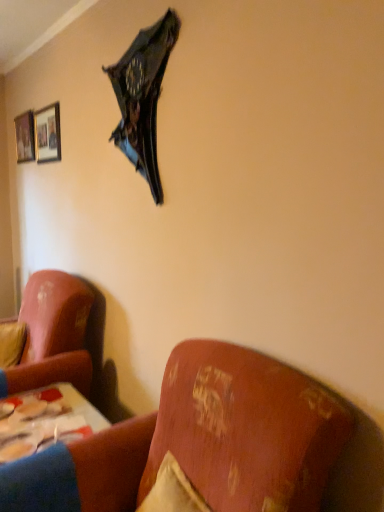
What is the approximate width of wooden table at lower left?

16.93 inches.

What do you see at coordinates (25, 137) in the screenshot? I see `wooden framed picture at upper left, the second picture frame when ordered from right to left` at bounding box center [25, 137].

What is the approximate width of wooden framed picture at upper left, the second picture frame when ordered from right to left?

wooden framed picture at upper left, the second picture frame when ordered from right to left, is 1.41 inches in width.

This screenshot has height=512, width=384. What do you see at coordinates (200, 441) in the screenshot?
I see `velvet-like pink couch at lower left` at bounding box center [200, 441].

This screenshot has height=512, width=384. What do you see at coordinates (48, 134) in the screenshot? I see `matte black picture frame at upper left, which is the 1th picture frame from front to back` at bounding box center [48, 134].

What is the approximate width of velvet yellow pillow at left?

velvet yellow pillow at left is 23.47 centimeters in width.

Identify the location of wooden table at lower left. This screenshot has width=384, height=512. (45, 420).

Measure the distance from wooden framed picture at upper left, arranged as the 1th picture frame when viewed from the back, to velvet-like pink couch at lower left.

wooden framed picture at upper left, arranged as the 1th picture frame when viewed from the back, is 2.48 meters from velvet-like pink couch at lower left.

You are a GUI agent. You are given a task and a screenshot of the screen. Output one action in this format:
    pyautogui.click(x=<x>, y=<y>)
    Task: Click on the 2nd picture frame behind the velvet-like pink couch at lower left
    Image resolution: width=384 pixels, height=512 pixels.
    Given the screenshot: What is the action you would take?
    pyautogui.click(x=25, y=137)

Can you confirm if wooden framed picture at upper left, arranged as the 1th picture frame when viewed from the back, is positioned to the left of velvet-like pink couch at lower left?

Yes.

Does wooden framed picture at upper left, marked as the 2th picture frame in a front-to-back arrangement, have a lesser width compared to velvet-like pink couch at lower left?

Correct, the width of wooden framed picture at upper left, marked as the 2th picture frame in a front-to-back arrangement, is less than that of velvet-like pink couch at lower left.

Would you say wooden table at lower left is inside or outside wooden framed picture at upper left, arranged as the 1th picture frame when viewed from the back?

wooden table at lower left is not enclosed by wooden framed picture at upper left, arranged as the 1th picture frame when viewed from the back.

Can you confirm if wooden table at lower left is positioned to the left of wooden framed picture at upper left, the second picture frame when ordered from right to left?

No.

Can you confirm if wooden table at lower left is bigger than wooden framed picture at upper left, arranged as the 1th picture frame when viewed from the back?

Yes.

Looking at this image, from a real-world perspective, is wooden table at lower left positioned under wooden framed picture at upper left, arranged as the 1th picture frame when viewed from the back, based on gravity?

Yes, from a real-world perspective, wooden table at lower left is under wooden framed picture at upper left, arranged as the 1th picture frame when viewed from the back.

Is wooden table at lower left far from velvet yellow pillow at left?

Actually, wooden table at lower left and velvet yellow pillow at left are a little close together.

Which object is wider, wooden table at lower left or velvet yellow pillow at left?

Wider between the two is wooden table at lower left.

Looking at this image, how far apart are wooden table at lower left and velvet yellow pillow at left?

wooden table at lower left and velvet yellow pillow at left are 17.99 inches apart from each other.

Which object is further away from the camera, wooden table at lower left or velvet yellow pillow at left?

velvet yellow pillow at left is more distant.

Could you tell me if shiny metallic umbrella at upper center is turned towards matte black picture frame at upper left, the second picture frame from the left?

No, shiny metallic umbrella at upper center is not turned towards matte black picture frame at upper left, the second picture frame from the left.

From a real-world perspective, is shiny metallic umbrella at upper center on matte black picture frame at upper left, which is the 1th picture frame from front to back?

No, from a real-world perspective, shiny metallic umbrella at upper center is not on top of matte black picture frame at upper left, which is the 1th picture frame from front to back.

From the image's perspective, which object appears higher, shiny metallic umbrella at upper center or matte black picture frame at upper left, the second picture frame from the left?

matte black picture frame at upper left, the second picture frame from the left.

Is shiny metallic umbrella at upper center at the left side of matte black picture frame at upper left, the second picture frame from the left?

In fact, shiny metallic umbrella at upper center is to the right of matte black picture frame at upper left, the second picture frame from the left.

Is wooden framed picture at upper left, the second picture frame when ordered from right to left, thinner than wooden table at lower left?

Yes.

Where is `table on the right of the wooden framed picture at upper left, the second picture frame when ordered from right to left`? The image size is (384, 512). table on the right of the wooden framed picture at upper left, the second picture frame when ordered from right to left is located at coordinates click(45, 420).

How different are the orientations of wooden framed picture at upper left, arranged as the 1th picture frame when viewed from the left, and wooden table at lower left in degrees?

There is a 0.0206-degree angle between the facing directions of wooden framed picture at upper left, arranged as the 1th picture frame when viewed from the left, and wooden table at lower left.

Is velvet yellow pillow at left completely or partially inside matte black picture frame at upper left, which is the 1th picture frame from front to back?

No, matte black picture frame at upper left, which is the 1th picture frame from front to back, does not contain velvet yellow pillow at left.

Between matte black picture frame at upper left, which is the 1th picture frame from front to back, and velvet yellow pillow at left, which one has more height?

Standing taller between the two is matte black picture frame at upper left, which is the 1th picture frame from front to back.

Does matte black picture frame at upper left, the second picture frame from the left, lie behind velvet yellow pillow at left?

That is True.

Is point (51, 116) positioned after point (10, 345)?

Yes, it is behind point (10, 345).

Is velvet yellow pillow at left placed right next to velvet-like pink couch at lower left?

No.

Between velvet yellow pillow at left and velvet-like pink couch at lower left, which one has smaller width?

Thinner between the two is velvet yellow pillow at left.

Considering the positions of objects velvet yellow pillow at left and velvet-like pink couch at lower left in the image provided, who is more to the right, velvet yellow pillow at left or velvet-like pink couch at lower left?

Positioned to the right is velvet-like pink couch at lower left.

Who is smaller, velvet yellow pillow at left or velvet-like pink couch at lower left?

With smaller size is velvet yellow pillow at left.

Where is `studio couch below the wooden framed picture at upper left, arranged as the 1th picture frame when viewed from the back (from the image's perspective)`? The height and width of the screenshot is (512, 384). studio couch below the wooden framed picture at upper left, arranged as the 1th picture frame when viewed from the back (from the image's perspective) is located at coordinates (200, 441).

From the wooden table at lower left, count the 2nd picture frame to the left and point to it. Please provide its 2D coordinates.

[(25, 137)]

Estimate the real-world distances between objects in this image. Which object is further from matte black picture frame at upper left, which is the 1th picture frame from front to back, wooden framed picture at upper left, the second picture frame when ordered from right to left, or velvet-like pink couch at lower left?

The object further to matte black picture frame at upper left, which is the 1th picture frame from front to back, is velvet-like pink couch at lower left.

Estimate the real-world distances between objects in this image. Which object is further from matte black picture frame at upper left, the 2th picture frame viewed from the back, velvet-like pink couch at lower left or wooden framed picture at upper left, marked as the 2th picture frame in a front-to-back arrangement?

Based on the image, velvet-like pink couch at lower left appears to be further to matte black picture frame at upper left, the 2th picture frame viewed from the back.

Looking at the image, which one is located closer to shiny metallic umbrella at upper center, velvet-like pink couch at lower left or velvet yellow pillow at left?

velvet-like pink couch at lower left.

Looking at this image, based on their spatial positions, is velvet yellow pillow at left or wooden framed picture at upper left, the second picture frame when ordered from right to left, further from matte black picture frame at upper left, the first picture frame from the right?

velvet yellow pillow at left lies further to matte black picture frame at upper left, the first picture frame from the right, than the other object.

Based on the photo, estimate the real-world distances between objects in this image. Which object is further from shiny metallic umbrella at upper center, wooden framed picture at upper left, arranged as the 1th picture frame when viewed from the back, or matte black picture frame at upper left, the 2th picture frame viewed from the back?

The object further to shiny metallic umbrella at upper center is wooden framed picture at upper left, arranged as the 1th picture frame when viewed from the back.

From the image, which object appears to be nearer to matte black picture frame at upper left, the second picture frame from the left, velvet yellow pillow at left or velvet-like pink couch at lower left?

Among the two, velvet yellow pillow at left is located nearer to matte black picture frame at upper left, the second picture frame from the left.

Based on their spatial positions, is shiny metallic umbrella at upper center or matte black picture frame at upper left, the 2th picture frame viewed from the back, closer to velvet-like pink couch at lower left?

The object closer to velvet-like pink couch at lower left is shiny metallic umbrella at upper center.

Which object lies nearer to the anchor point velvet yellow pillow at left, wooden table at lower left or wooden framed picture at upper left, the second picture frame when ordered from right to left?

wooden table at lower left is closer to velvet yellow pillow at left.

Identify the location of umbrella between matte black picture frame at upper left, the 2th picture frame viewed from the back, and velvet yellow pillow at left, in the vertical direction. (143, 96).

You are a GUI agent. You are given a task and a screenshot of the screen. Output one action in this format:
    pyautogui.click(x=<x>, y=<y>)
    Task: Click on the pillow between shiny metallic umbrella at upper center and wooden table at lower left in the vertical direction
    This screenshot has width=384, height=512.
    Given the screenshot: What is the action you would take?
    pyautogui.click(x=11, y=343)

At what (x,y) coordinates should I click in order to perform the action: click on picture frame that lies between wooden framed picture at upper left, the second picture frame when ordered from right to left, and velvet yellow pillow at left from top to bottom. Please return your answer as a coordinate pair (x, y). Looking at the image, I should click on coord(48,134).

Identify the location of pillow between matte black picture frame at upper left, the first picture frame from the right, and wooden table at lower left, in the vertical direction. This screenshot has height=512, width=384. (11, 343).